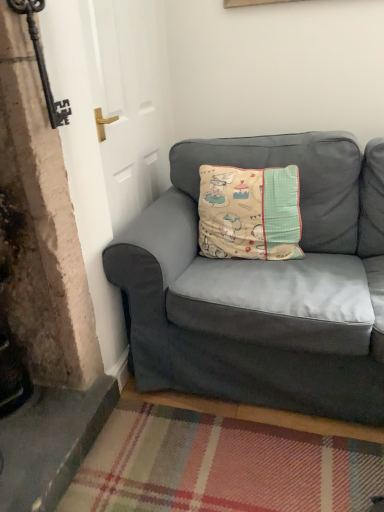
Question: From the image's perspective, is beige fabric cushion at center on suede gray couch at lower right?

Choices:
 (A) no
 (B) yes

Answer: (B)

Question: Does beige fabric cushion at center have a lesser width compared to suede gray couch at lower right?

Choices:
 (A) yes
 (B) no

Answer: (A)

Question: Can you confirm if beige fabric cushion at center is smaller than suede gray couch at lower right?

Choices:
 (A) no
 (B) yes

Answer: (B)

Question: Does beige fabric cushion at center lie in front of suede gray couch at lower right?

Choices:
 (A) yes
 (B) no

Answer: (B)

Question: Is beige fabric cushion at center outside suede gray couch at lower right?

Choices:
 (A) yes
 (B) no

Answer: (B)

Question: From the image's perspective, is beige fabric cushion at center below suede gray couch at lower right?

Choices:
 (A) yes
 (B) no

Answer: (B)

Question: Can you confirm if suede gray couch at lower right is smaller than beige fabric cushion at center?

Choices:
 (A) yes
 (B) no

Answer: (B)

Question: Would you say beige fabric cushion at center is part of suede gray couch at lower right's contents?

Choices:
 (A) no
 (B) yes

Answer: (B)

Question: Is suede gray couch at lower right outside beige fabric cushion at center?

Choices:
 (A) no
 (B) yes

Answer: (B)

Question: Considering the relative positions of suede gray couch at lower right and beige fabric cushion at center in the image provided, is suede gray couch at lower right in front of beige fabric cushion at center?

Choices:
 (A) no
 (B) yes

Answer: (B)

Question: From a real-world perspective, is suede gray couch at lower right physically below beige fabric cushion at center?

Choices:
 (A) no
 (B) yes

Answer: (B)

Question: Is suede gray couch at lower right at the left side of beige fabric cushion at center?

Choices:
 (A) no
 (B) yes

Answer: (A)

Question: Considering the positions of beige fabric cushion at center and suede gray couch at lower right in the image, is beige fabric cushion at center bigger or smaller than suede gray couch at lower right?

Choices:
 (A) small
 (B) big

Answer: (A)